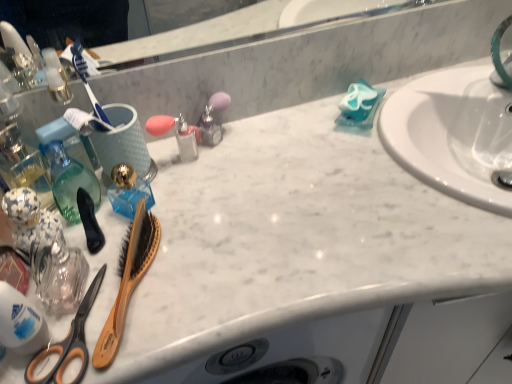
At what (x,y) coordinates should I click in order to perform the action: click on vacant area to the right of orange-handled scissors at lower left. Please return your answer as a coordinate pair (x, y). Looking at the image, I should click on (204, 296).